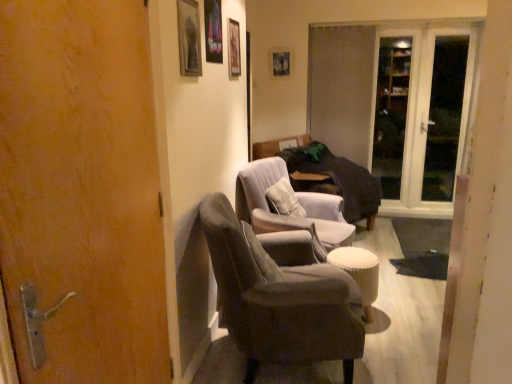
Question: Considering the relative sizes of velvet grey armchair at center, which is the 1th chair in front-to-back order, and white glass door at upper right in the image provided, is velvet grey armchair at center, which is the 1th chair in front-to-back order, smaller than white glass door at upper right?

Choices:
 (A) no
 (B) yes

Answer: (A)

Question: From the image's perspective, is velvet grey armchair at center, which is the 1th chair in front-to-back order, located beneath white glass door at upper right?

Choices:
 (A) no
 (B) yes

Answer: (B)

Question: Considering the relative sizes of velvet grey armchair at center, which is the second chair from back to front, and white glass door at upper right in the image provided, is velvet grey armchair at center, which is the second chair from back to front, wider than white glass door at upper right?

Choices:
 (A) yes
 (B) no

Answer: (A)

Question: Considering the relative positions of velvet grey armchair at center, which is the second chair from back to front, and white glass door at upper right in the image provided, is velvet grey armchair at center, which is the second chair from back to front, in front of white glass door at upper right?

Choices:
 (A) no
 (B) yes

Answer: (B)

Question: Considering the relative sizes of velvet grey armchair at center, which is the second chair from back to front, and white glass door at upper right in the image provided, is velvet grey armchair at center, which is the second chair from back to front, bigger than white glass door at upper right?

Choices:
 (A) no
 (B) yes

Answer: (B)

Question: Considering the positions of wooden picture frame at upper center, the 1th picture frame viewed from the back, and wooden door at left in the image, is wooden picture frame at upper center, the 1th picture frame viewed from the back, taller or shorter than wooden door at left?

Choices:
 (A) tall
 (B) short

Answer: (B)

Question: Do you think wooden picture frame at upper center, acting as the 4th picture frame starting from the left, is within wooden door at left, or outside of it?

Choices:
 (A) outside
 (B) inside

Answer: (A)

Question: From the image's perspective, is wooden picture frame at upper center, the first picture frame positioned from the right, positioned above or below wooden door at left?

Choices:
 (A) above
 (B) below

Answer: (A)

Question: Considering their positions, is wooden picture frame at upper center, the 1th picture frame viewed from the back, located in front of or behind wooden door at left?

Choices:
 (A) behind
 (B) front

Answer: (A)

Question: Considering the positions of velvet grey armchair at center, which is the second chair from back to front, and matte glass screen door at center, acting as the third screen door starting from the right, in the image, is velvet grey armchair at center, which is the second chair from back to front, taller or shorter than matte glass screen door at center, acting as the third screen door starting from the right,?

Choices:
 (A) tall
 (B) short

Answer: (B)

Question: Considering the positions of point (284, 279) and point (351, 82), is point (284, 279) closer or farther from the camera than point (351, 82)?

Choices:
 (A) closer
 (B) farther

Answer: (A)

Question: Would you say velvet grey armchair at center, which is the 1th chair in front-to-back order, is to the left or to the right of matte glass screen door at center, the 1th screen door viewed from the left, in the picture?

Choices:
 (A) right
 (B) left

Answer: (B)

Question: Relative to matte glass screen door at center, acting as the third screen door starting from the right, is velvet grey armchair at center, which is the second chair from back to front, in front or behind?

Choices:
 (A) behind
 (B) front

Answer: (B)

Question: Relative to suede-like gray armchair at center, positioned as the 2th chair in front-to-back order, is wooden picture frame at upper center, acting as the 4th picture frame starting from the left, in front or behind?

Choices:
 (A) front
 (B) behind

Answer: (B)

Question: Does point (275, 66) appear closer or farther from the camera than point (248, 167)?

Choices:
 (A) closer
 (B) farther

Answer: (B)